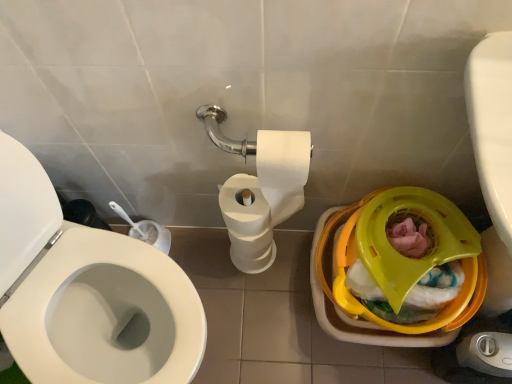
Question: Can you confirm if white matte toilet paper at center is shorter than yellow plastic potty at lower right?

Choices:
 (A) no
 (B) yes

Answer: (A)

Question: From the image's perspective, is white matte toilet paper at center beneath yellow plastic potty at lower right?

Choices:
 (A) no
 (B) yes

Answer: (A)

Question: Is white matte toilet paper at center positioned with its back to yellow plastic potty at lower right?

Choices:
 (A) no
 (B) yes

Answer: (A)

Question: Does white matte toilet paper at center have a greater width compared to yellow plastic potty at lower right?

Choices:
 (A) no
 (B) yes

Answer: (A)

Question: From the image's perspective, is white matte toilet paper at center over yellow plastic potty at lower right?

Choices:
 (A) yes
 (B) no

Answer: (A)

Question: Is white matte toilet paper at center surrounding yellow plastic potty at lower right?

Choices:
 (A) no
 (B) yes

Answer: (A)

Question: Is white matte toilet paper at center completely or partially inside yellow plastic potty at lower right?

Choices:
 (A) yes
 (B) no

Answer: (B)

Question: Considering the relative sizes of yellow plastic potty at lower right and white matte toilet paper at center in the image provided, is yellow plastic potty at lower right shorter than white matte toilet paper at center?

Choices:
 (A) no
 (B) yes

Answer: (B)

Question: Are yellow plastic potty at lower right and white matte toilet paper at center located far from each other?

Choices:
 (A) no
 (B) yes

Answer: (A)

Question: Can we say yellow plastic potty at lower right lies outside white matte toilet paper at center?

Choices:
 (A) no
 (B) yes

Answer: (B)

Question: Is yellow plastic potty at lower right at the left side of white matte toilet paper at center?

Choices:
 (A) yes
 (B) no

Answer: (B)

Question: From a real-world perspective, is yellow plastic potty at lower right physically above white matte toilet paper at center?

Choices:
 (A) yes
 (B) no

Answer: (A)

Question: Is white matte toilet paper at center to the left or to the right of yellow plastic potty at lower right in the image?

Choices:
 (A) right
 (B) left

Answer: (B)